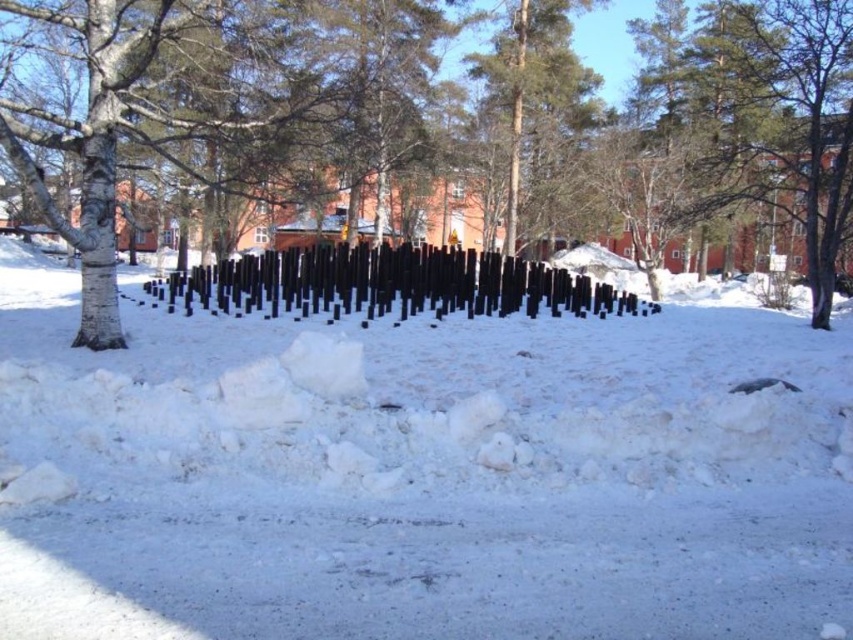
Question: Estimate the real-world distances between objects in this image. Which object is closer to the white fluffy snow at center?

Choices:
 (A) bark textured tree at center
 (B) black polished wood posts at center

Answer: (B)

Question: Is white fluffy snow at center below bark textured tree at center?

Choices:
 (A) yes
 (B) no

Answer: (A)

Question: From the image, what is the correct spatial relationship of white fluffy snow at center in relation to bark textured tree at center?

Choices:
 (A) left
 (B) right

Answer: (B)

Question: Which of the following is the farthest from the observer?

Choices:
 (A) (274, 316)
 (B) (529, 102)

Answer: (B)

Question: In this image, where is white fluffy snow at center located relative to black polished wood posts at center?

Choices:
 (A) right
 (B) left

Answer: (A)

Question: Which point appears farthest from the camera in this image?

Choices:
 (A) (107, 246)
 (B) (486, 310)
 (C) (699, 364)

Answer: (B)